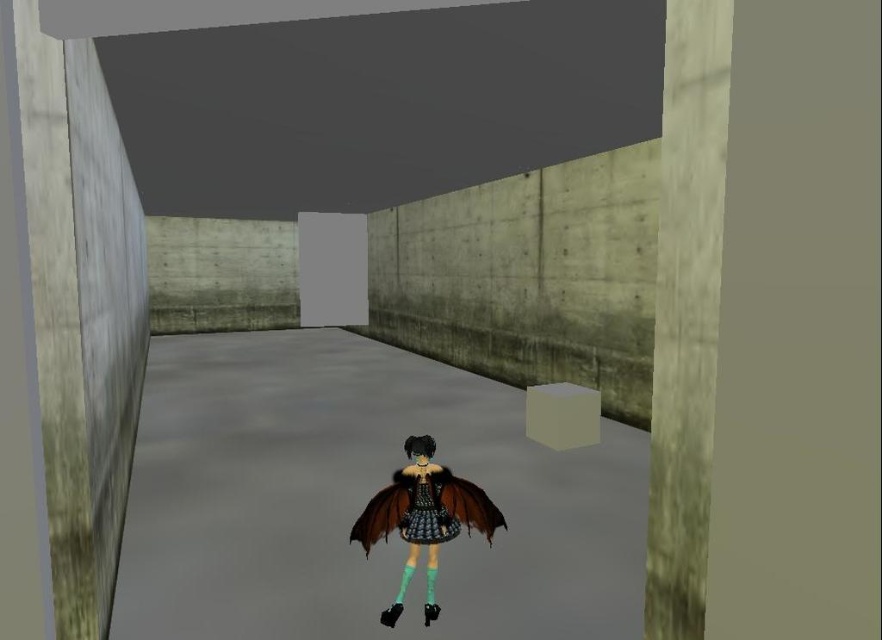
Question: Where is smooth concrete pillar at left located in relation to shiny black dress at center in the image?

Choices:
 (A) above
 (B) below

Answer: (A)

Question: Does smooth concrete pillar at left appear on the left side of concrete wall at right?

Choices:
 (A) no
 (B) yes

Answer: (B)

Question: Which point is closer to the camera?

Choices:
 (A) concrete wall at right
 (B) shiny black lace dress at center

Answer: (A)

Question: Can you confirm if concrete wall at right is positioned to the right of shiny black dress at center?

Choices:
 (A) yes
 (B) no

Answer: (A)

Question: Based on their relative distances, which object is farther from the shiny black dress at center?

Choices:
 (A) smooth concrete pillar at left
 (B) shiny black lace dress at center

Answer: (A)

Question: Based on their relative distances, which object is farther from the shiny black dress at center?

Choices:
 (A) shiny black lace dress at center
 (B) concrete wall at right

Answer: (B)